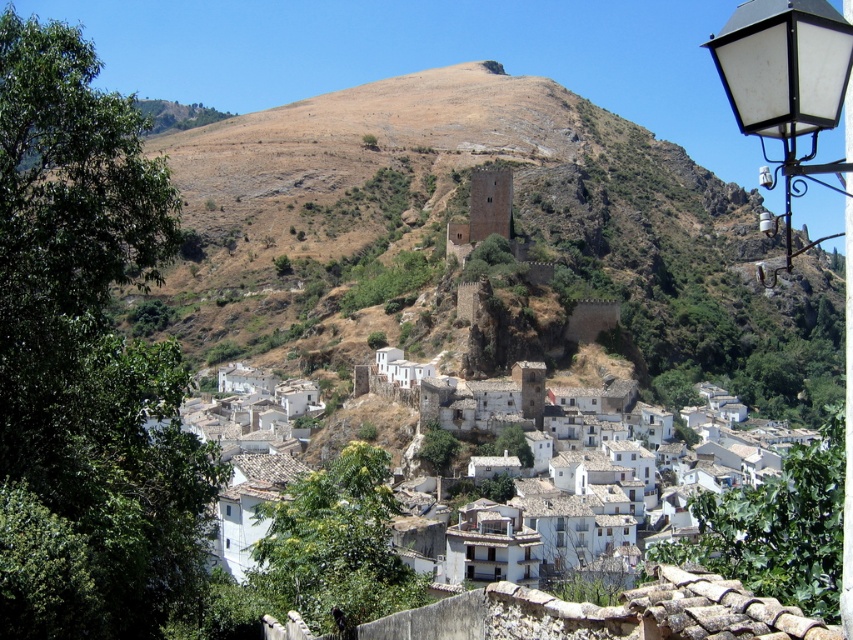
Who is more forward, [831,49] or [256,390]?

Point [831,49]

Which is behind, point (726, 33) or point (235, 458)?

Positioned behind is point (235, 458).

Is point (778, 64) farther from viewer compared to point (373, 369)?

No, (778, 64) is closer to viewer.

The height and width of the screenshot is (640, 853). In order to click on white matte street light at upper right in this screenshot , I will do `click(784, 68)`.

Does brown rocky mountain at center have a larger size compared to white stone buildings at center?

Correct, brown rocky mountain at center is larger in size than white stone buildings at center.

Does brown rocky mountain at center appear on the right side of white stone buildings at center?

In fact, brown rocky mountain at center is to the left of white stone buildings at center.

Does point (206, 150) lie behind point (296, 470)?

Yes, point (206, 150) is farther from viewer.

Identify the location of brown rocky mountain at center. (514, 227).

Is brown rocky mountain at center shorter than white matte street light at upper right?

No.

Is point (804, 336) positioned in front of point (709, 42)?

That is False.

At what (x,y) coordinates should I click in order to perform the action: click on brown rocky mountain at center. Please return your answer as a coordinate pair (x, y). Looking at the image, I should click on (514, 227).